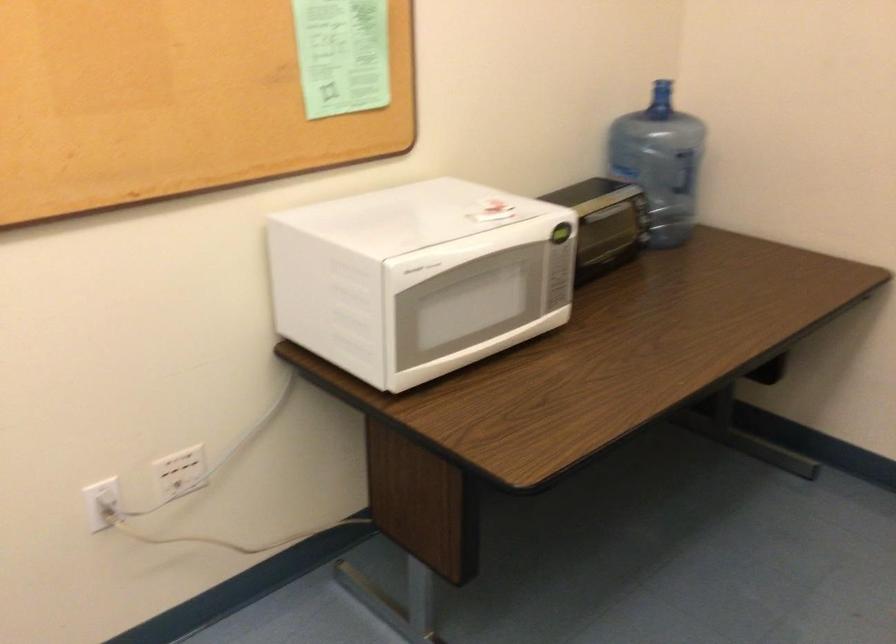
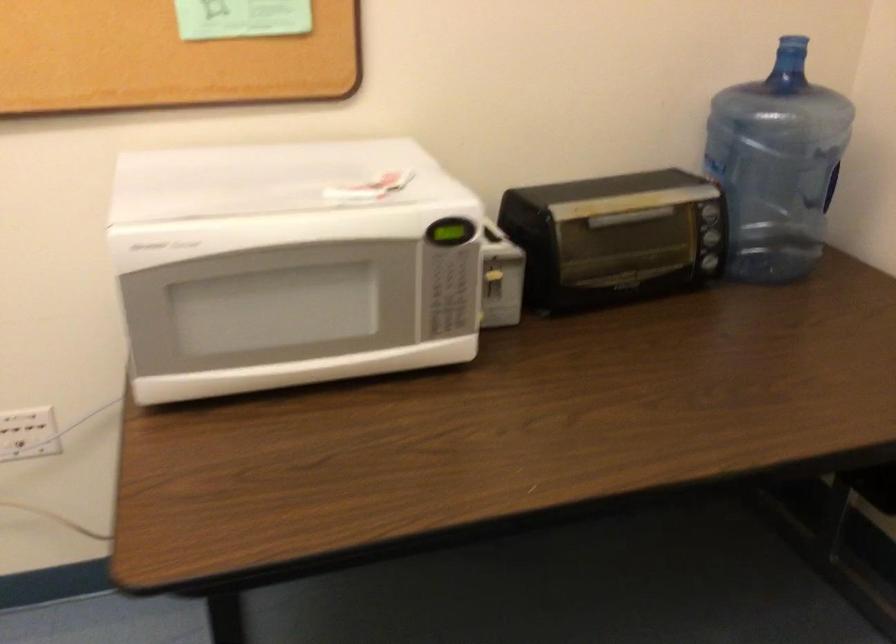
Question: The camera is either moving clockwise (left) or counter-clockwise (right) around the object. The first image is from the beginning of the video and the second image is from the end. Is the camera moving left or right when shooting the video?

Choices:
 (A) Left
 (B) Right

Answer: (B)